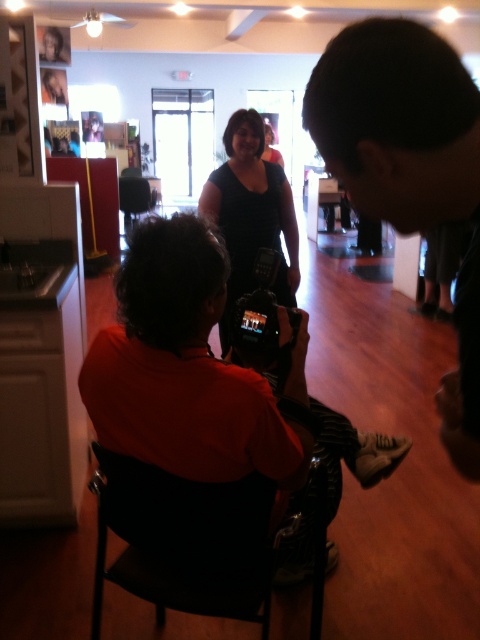
You are at an event and need to adjust your position so that the matte black dress at center is visible in the screen of the black plastic video camera at center. Can you move forward or backward to achieve this?

The black plastic video camera at center is behind matte black dress at center, so you should move forward to bring the matte black dress at center into the camera view.